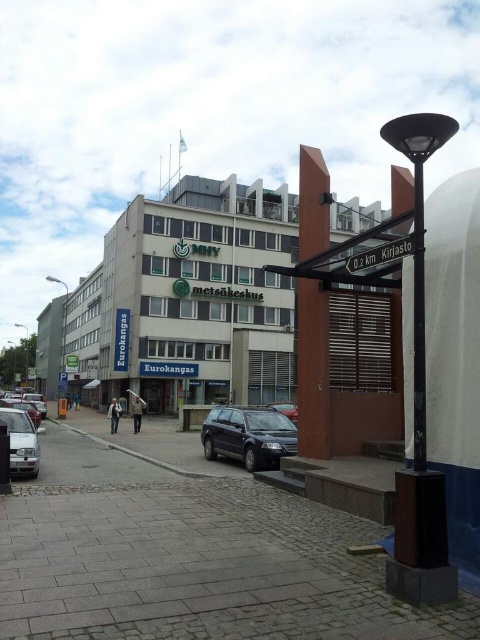
Which is in front, point (271, 435) or point (356, 266)?

Point (356, 266) is in front.

In the scene shown: Between shiny black car at center and white plastic sign at center, which one is positioned lower?

shiny black car at center is below.

Between point (223, 429) and point (361, 257), which one is positioned in front?

Point (361, 257) is in front.

Locate an element on the screen. The height and width of the screenshot is (640, 480). shiny black car at center is located at coordinates (249, 435).

Is point (255, 406) farther from viewer compared to point (269, 403)?

No, it is in front of (269, 403).

Can you confirm if shiny black car at center is shorter than metallic silver car at center?

Yes, shiny black car at center is shorter than metallic silver car at center.

Between point (274, 413) and point (279, 410), which one is positioned behind?

The point (279, 410) is behind.

At what (x,y) coordinates should I click in order to perform the action: click on shiny black car at center. Please return your answer as a coordinate pair (x, y). Looking at the image, I should click on (x=249, y=435).

Between silver metallic car at left and metallic silver car at center, which one appears on the right side from the viewer's perspective?

metallic silver car at center is more to the right.

Does silver metallic car at left have a lesser width compared to metallic silver car at center?

Correct, silver metallic car at left's width is less than metallic silver car at center's.

I want to click on silver metallic car at left, so [x=22, y=442].